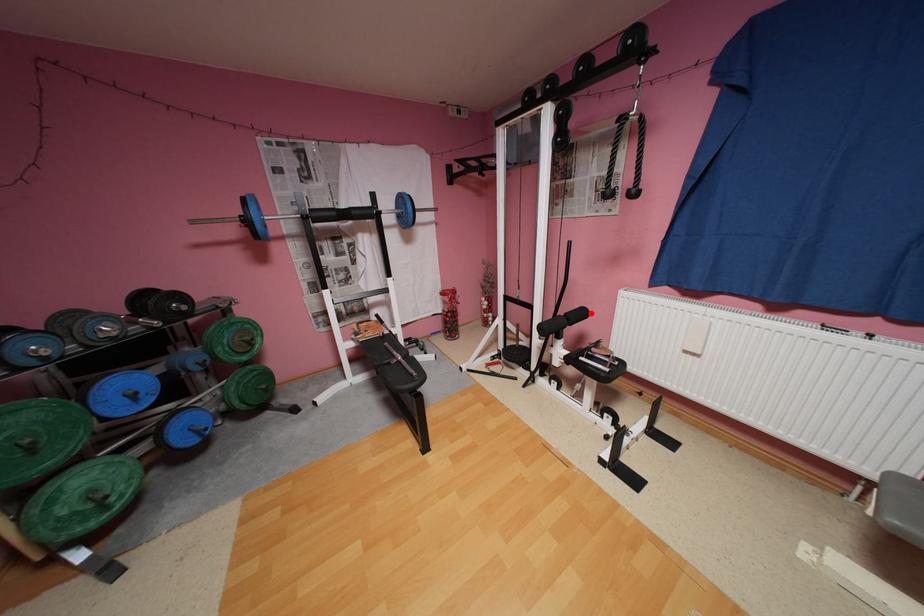
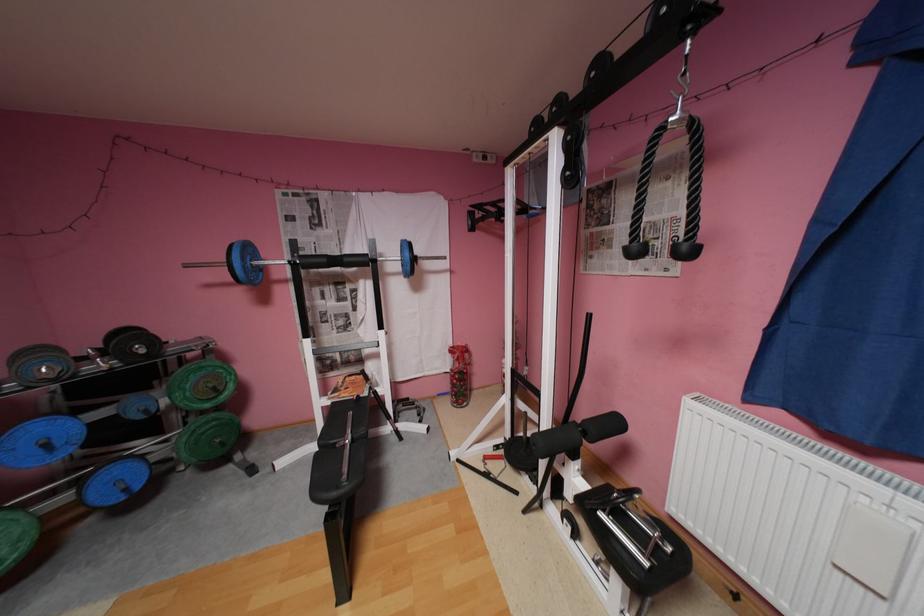
Locate, in the second image, the point that corresponds to the highlighted location in the first image.

(624, 424)